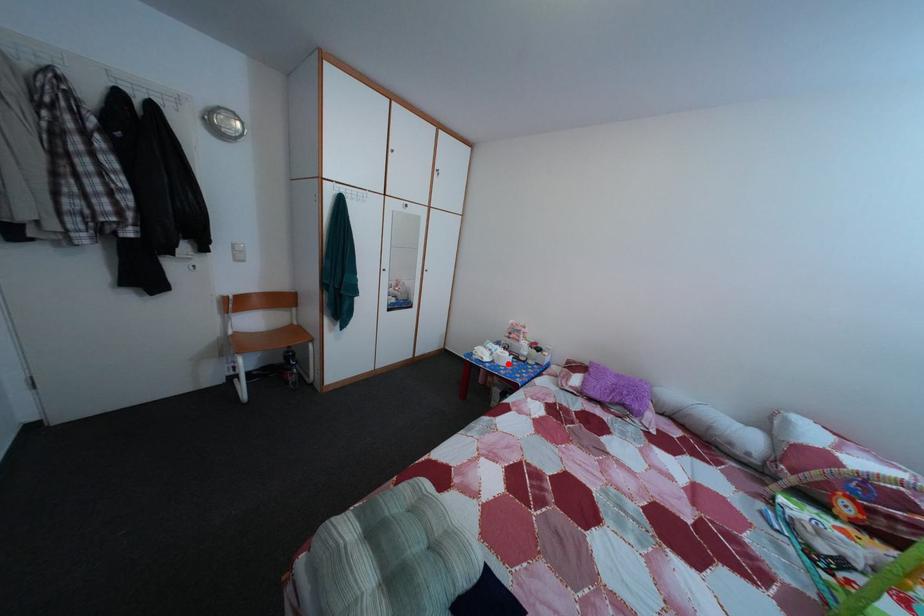
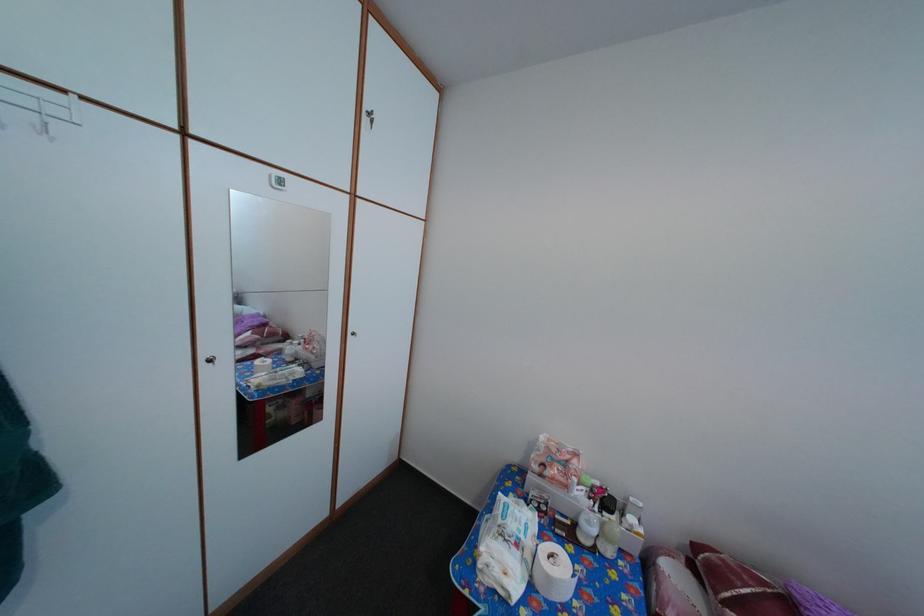
Find the pixel in the second image that matches the highlighted location in the first image.

(558, 586)